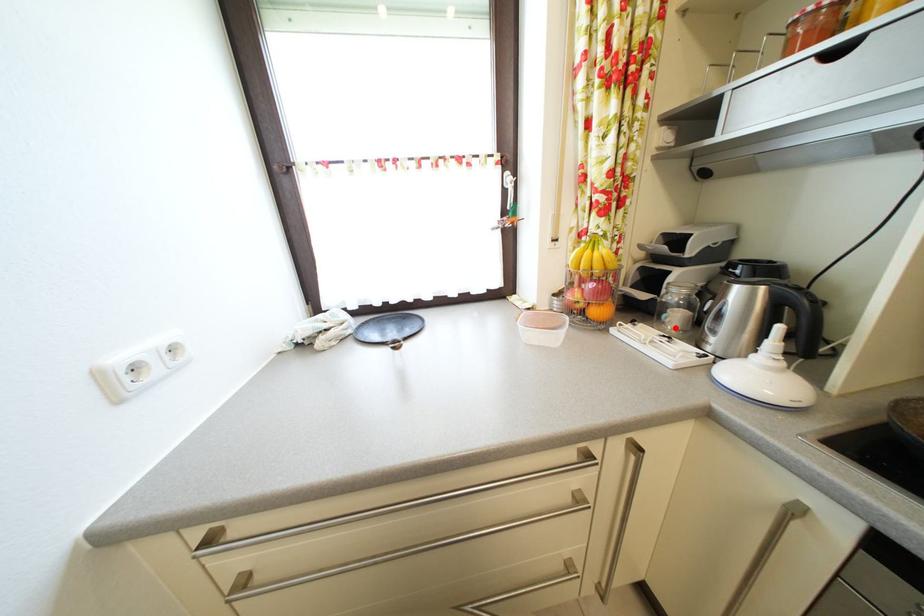
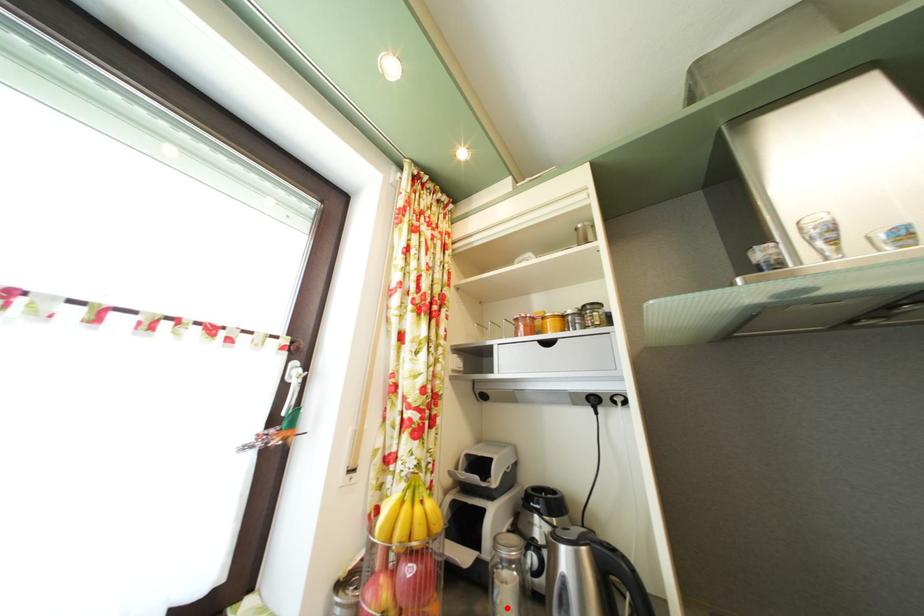
Looking at this image, I am providing you with two images of the same scene from different viewpoints. A red point is marked on the first image and another point is marked on the second image. Is the marked point in image1 the same physical position as the marked point in image2?

Yes